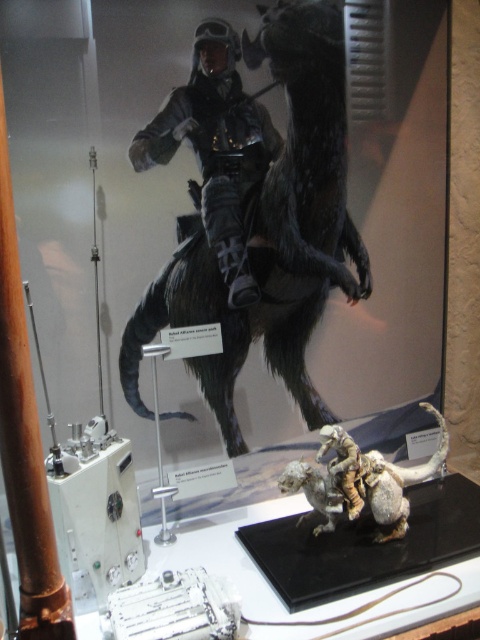
Question: Which of the following is the farthest from the observer?

Choices:
 (A) (333, 74)
 (B) (358, 508)

Answer: (A)

Question: Is furry black horse at center positioned behind white matte dinosaur at lower center?

Choices:
 (A) no
 (B) yes

Answer: (B)

Question: Is furry black horse at center thinner than white matte dinosaur at lower center?

Choices:
 (A) yes
 (B) no

Answer: (B)

Question: Does shiny silver spacesuit at upper center have a greater width compared to white matte dinosaur at lower center?

Choices:
 (A) no
 (B) yes

Answer: (A)

Question: Which object is closer to the camera taking this photo?

Choices:
 (A) furry black horse at center
 (B) shiny silver spacesuit at upper center

Answer: (B)

Question: Which point is closer to the camera?

Choices:
 (A) tap(253, 256)
 (B) tap(375, 460)
 (C) tap(248, 170)

Answer: (B)